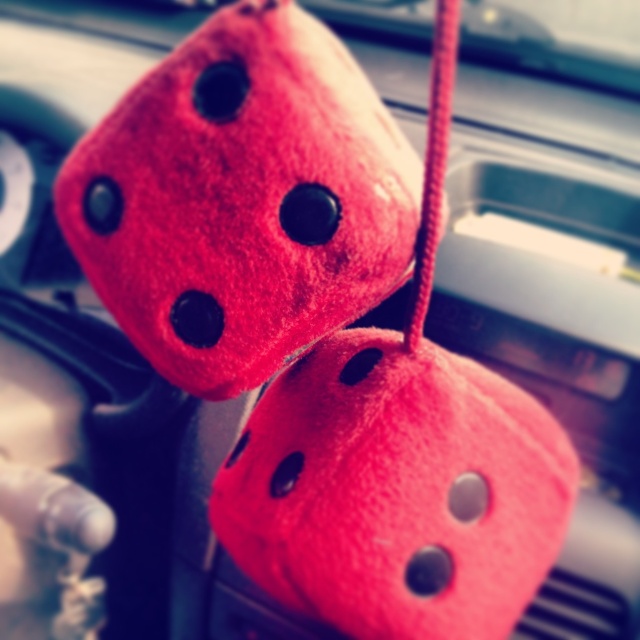
Where is `fuzzy red dice at upper center`? The height and width of the screenshot is (640, 640). fuzzy red dice at upper center is located at coordinates (243, 198).

Is fuzzy red dice at upper center below fuzzy red dice at center?

No, fuzzy red dice at upper center is not below fuzzy red dice at center.

Which is in front, point (170, 216) or point (419, 531)?

Point (170, 216) is in front.

This screenshot has width=640, height=640. I want to click on fuzzy red dice at upper center, so click(243, 198).